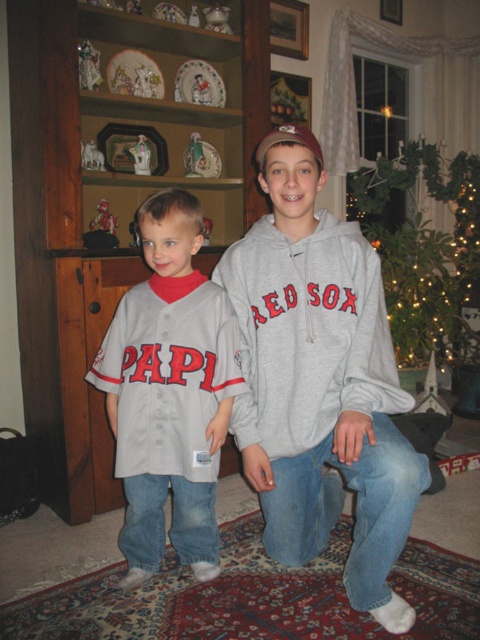
Who is lower down, gray cotton sweatshirt at center or iridescent glass ornaments at upper right?

gray cotton sweatshirt at center is below.

Is gray cotton sweatshirt at center below iridescent glass ornaments at upper right?

Yes, gray cotton sweatshirt at center is below iridescent glass ornaments at upper right.

Which is behind, point (303, 342) or point (416, 307)?

Point (416, 307)

Locate an element on the screen. The width and height of the screenshot is (480, 640). gray cotton sweatshirt at center is located at coordinates (308, 333).

This screenshot has height=640, width=480. What do you see at coordinates (168, 392) in the screenshot?
I see `gray fabric baseball jersey at center` at bounding box center [168, 392].

This screenshot has height=640, width=480. In order to click on gray fabric baseball jersey at center in this screenshot , I will do `click(168, 392)`.

Does point (197, 320) come closer to viewer compared to point (322, 374)?

That is False.

Identify the location of gray fabric baseball jersey at center. The width and height of the screenshot is (480, 640). click(168, 392).

Between point (302, 410) and point (330, 348), which one is positioned behind?

Point (302, 410)

Does gray cotton hoodie at center appear under gray cotton sweatshirt at center?

Yes, gray cotton hoodie at center is below gray cotton sweatshirt at center.

Is point (320, 280) positioned after point (356, 394)?

That is True.

Where is `gray cotton hoodie at center`? This screenshot has width=480, height=640. gray cotton hoodie at center is located at coordinates (322, 380).